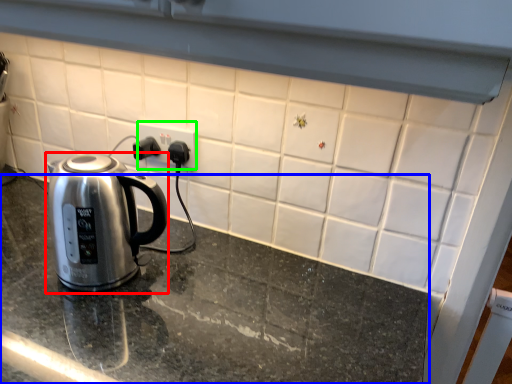
Question: Based on their relative distances, which object is farther from kettle (highlighted by a red box)? Choose from table top (highlighted by a blue box) and electric outlet (highlighted by a green box).

Choices:
 (A) table top
 (B) electric outlet

Answer: (B)